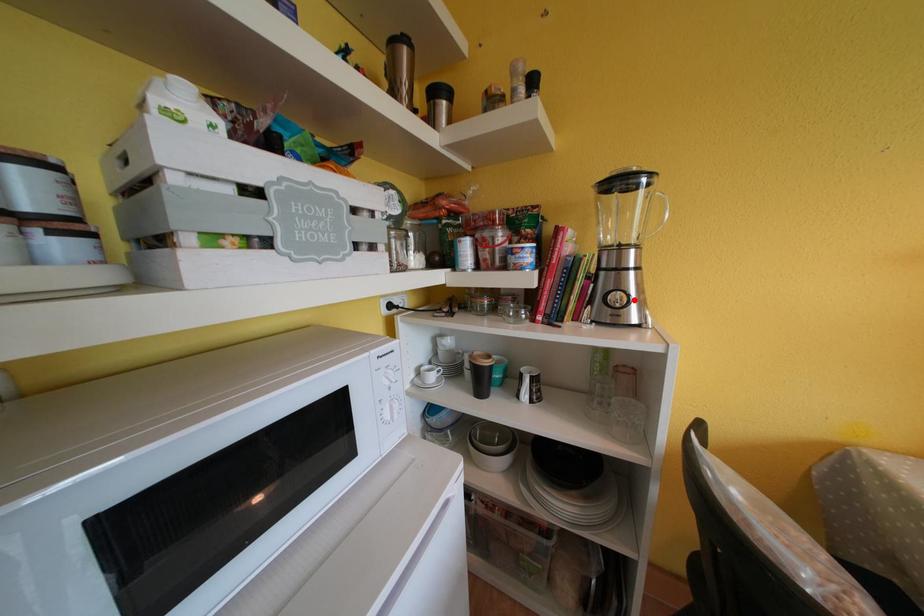
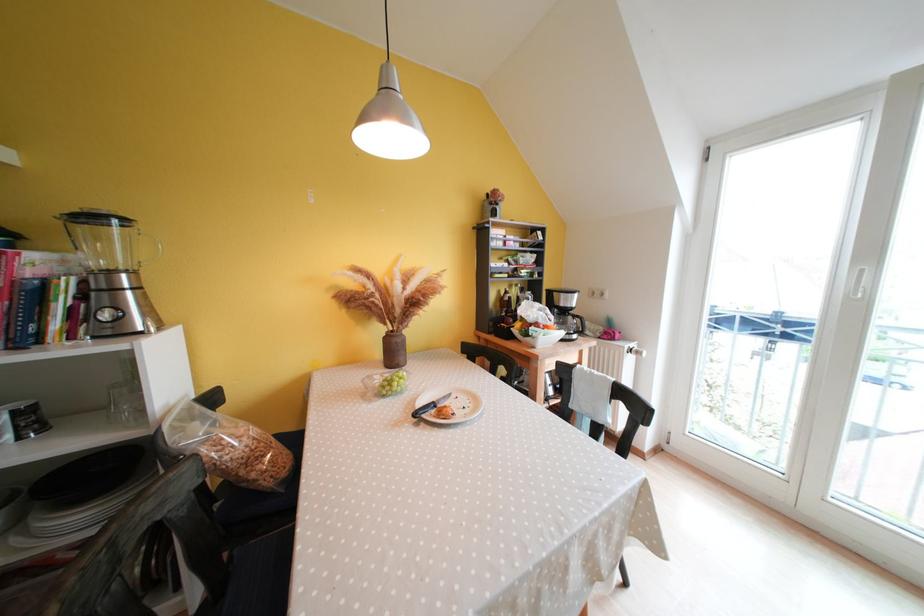
Where in the second image is the point corresponding to the highlighted location from the first image?

(132, 315)